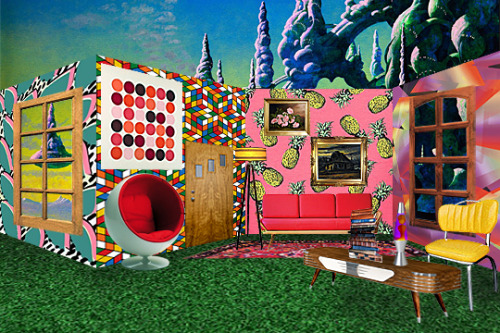
You are a GUI agent. You are given a task and a screenshot of the screen. Output one action in this format:
    pyautogui.click(x=<x>, y=<y>)
    Task: Click on the lamp
    The image size is (500, 333).
    Given the screenshot: What is the action you would take?
    pyautogui.click(x=359, y=238), pyautogui.click(x=240, y=153)